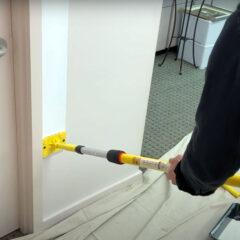
This screenshot has height=240, width=240. Find the location of `door handle`. door handle is located at coordinates (5, 48).